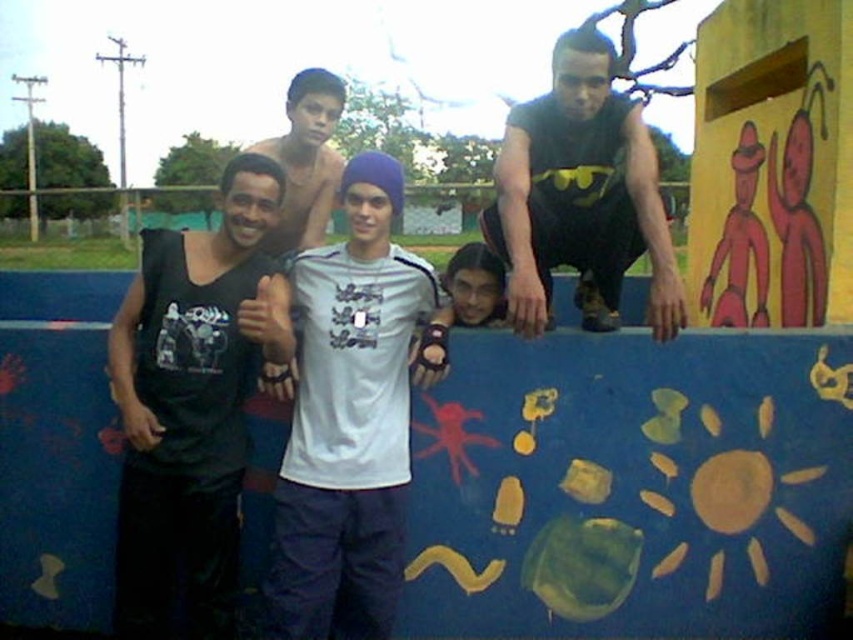
You are a photographer trying to capture a closeup of the black matte tank top at left and the shiny skin at center. Which one would you need to focus on first if you start from the ground and move upwards?

The black matte tank top at left is located below shiny skin at center, so you would need to focus on the black matte tank top at left first when moving upwards from the ground.

You are a photographer taking a group photo of the five individuals in front of the painted wall. You notice two areas of skin tone in the image. The shiny skin at center and the smooth skin face at center. Which skin area is positioned higher in the photo?

The shiny skin at center is positioned higher in the photo as it is above the smooth skin face at center.